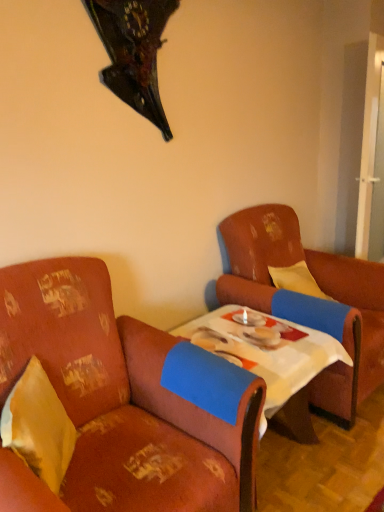
Question: Is floral fabric armchair at left, placed as the first chair when sorted from left to right, spatially inside white cloth-covered table at center, or outside of it?

Choices:
 (A) outside
 (B) inside

Answer: (A)

Question: Is floral fabric armchair at left, the 2th chair positioned from the right, bigger or smaller than white cloth-covered table at center?

Choices:
 (A) big
 (B) small

Answer: (A)

Question: Estimate the real-world distances between objects in this image. Which object is farther from the yellow fabric pillow at left?

Choices:
 (A) floral fabric armchair at left, the 2th chair positioned from the right
 (B) leather armchair at right, acting as the second chair starting from the left
 (C) white cloth-covered table at center

Answer: (B)

Question: Considering the real-world distances, which object is closest to the white cloth-covered table at center?

Choices:
 (A) yellow fabric pillow at left
 (B) leather armchair at right, acting as the second chair starting from the left
 (C) floral fabric armchair at left, placed as the first chair when sorted from left to right

Answer: (B)